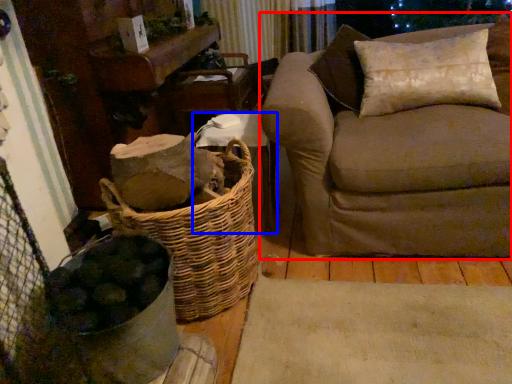
Question: Which object appears closest to the camera in this image, studio couch (highlighted by a red box) or furniture (highlighted by a blue box)?

Choices:
 (A) studio couch
 (B) furniture

Answer: (A)